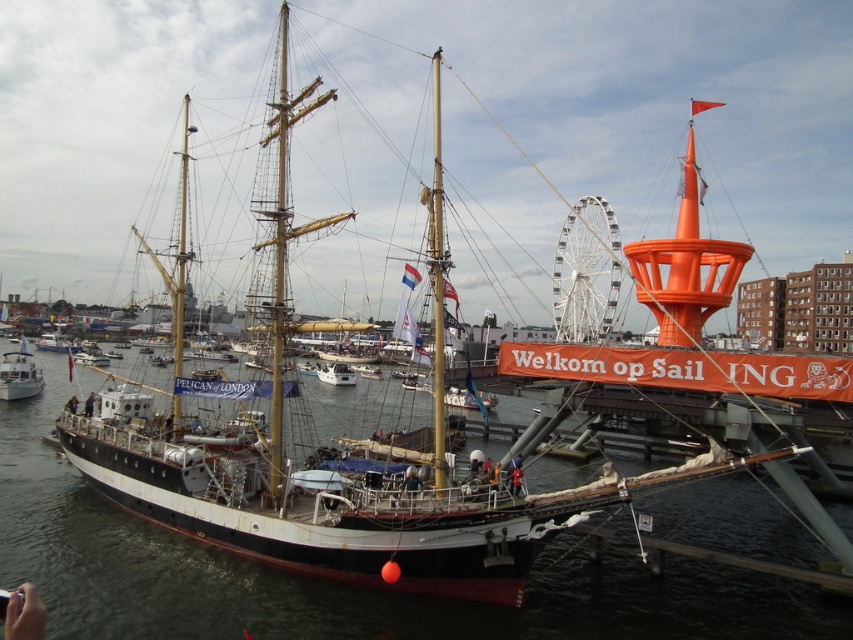
You are a photographer standing on the pier and want to capture both the black water at center and the white matte boat at center in a single shot. Which object should you position closer to the left side of your camera frame to ensure both are visible?

To ensure both the black water at center and the white matte boat at center are visible in your shot, position the white matte boat at center on the left side of your frame since the black water at center is located to its right.

You are a photographer planning to take a wide shot of the black water at center and the white glossy boat at center. Based on their sizes in the image, which one would you need to focus on more carefully to ensure it appears clear and detailed in the photo?

The black water at center might be wider than the white glossy boat at center, so you should focus more on the white glossy boat at center to ensure its details are clear since it is smaller and might be harder to capture in detail.

You are a sailor who needs to secure your anchor. You see the black water at center and the white matte boat at center. Where should you drop the anchor so it won

The black water at center is positioned under the white matte boat at center, so you should drop the anchor into the black water at center located beneath the boat to ensure it reaches the seabed properly.